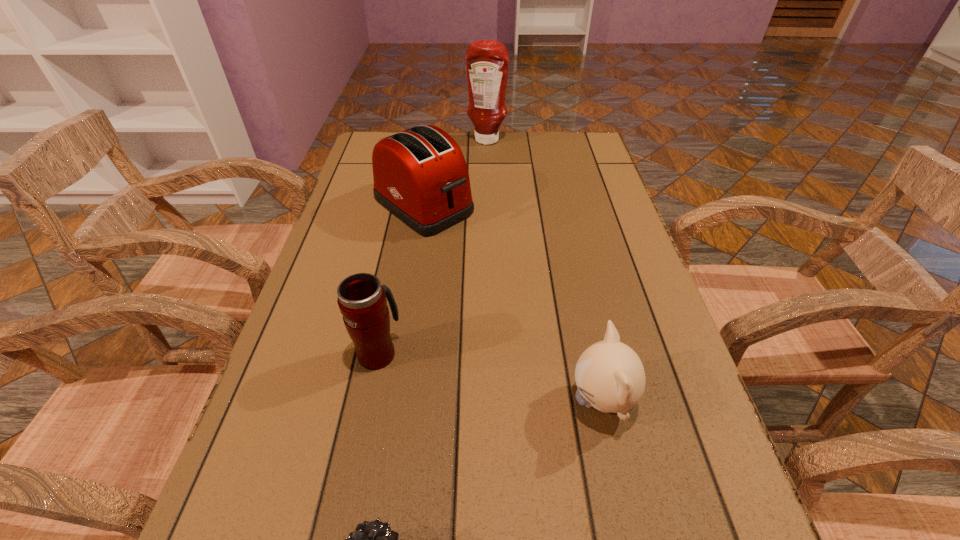
The width and height of the screenshot is (960, 540). In order to click on free point located on the side with the handle of the thermos bottle in this screenshot , I will do `click(396, 262)`.

Locate an element on the screen. The height and width of the screenshot is (540, 960). free space located on the face of the rightmost object is located at coordinates (367, 401).

At what (x,y) coordinates should I click in order to perform the action: click on free space located 0.400m on the face of the rightmost object. Please return your answer as a coordinate pair (x, y). Looking at the image, I should click on (337, 401).

This screenshot has height=540, width=960. I want to click on free location located on the face of the rightmost object, so click(x=447, y=401).

Locate an element on the screen. object situated at the far edge is located at coordinates (487, 61).

Identify the location of toaster that is at the left edge. (420, 175).

You are a GUI agent. You are given a task and a screenshot of the screen. Output one action in this format:
    pyautogui.click(x=<x>, y=<y>)
    Task: Click on the thermos bottle located at the left edge
    
    Given the screenshot: What is the action you would take?
    pyautogui.click(x=362, y=301)

You are a GUI agent. You are given a task and a screenshot of the screen. Output one action in this format:
    pyautogui.click(x=<x>, y=<y>)
    Task: Click on the object that is at the right edge
    
    Given the screenshot: What is the action you would take?
    pyautogui.click(x=610, y=377)

You are a GUI agent. You are given a task and a screenshot of the screen. Output one action in this format:
    pyautogui.click(x=<x>, y=<y>)
    Task: Click on the free location at the far edge of the desktop
    
    Given the screenshot: What is the action you would take?
    [x=510, y=134]

This screenshot has height=540, width=960. In the image, there is a desktop. What are the coordinates of `free space at the left edge` in the screenshot? It's located at (283, 395).